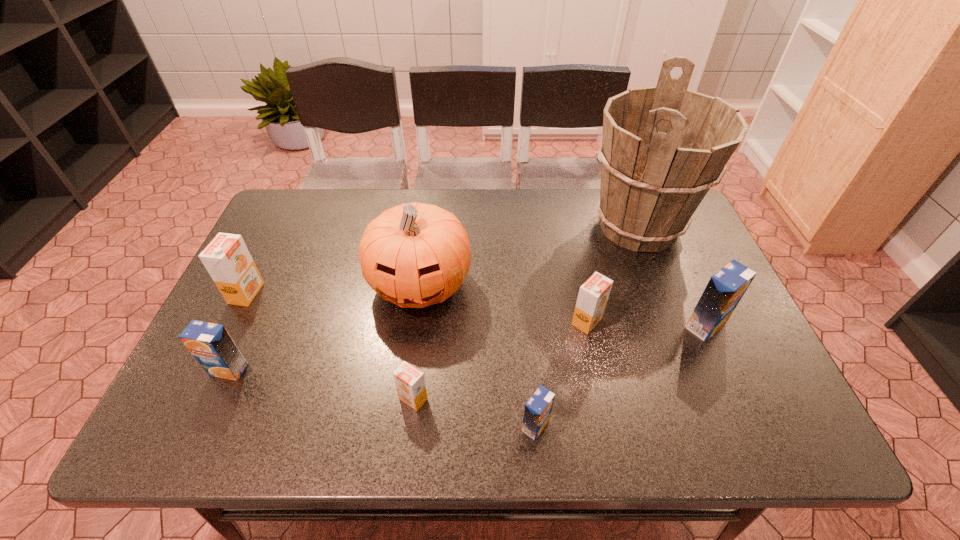
This screenshot has width=960, height=540. I want to click on the second smallest blue orange_juice, so click(x=211, y=345).

I want to click on the nearest orange orange juice, so click(410, 383).

I want to click on the smallest orange orange juice, so click(410, 383).

The image size is (960, 540). I want to click on the fourth object from right to left, so click(x=537, y=412).

Where is `the third orange_juice from right to left`? the third orange_juice from right to left is located at coordinates (537, 412).

The image size is (960, 540). Find the location of `vacant position located on the front of the bucket`. vacant position located on the front of the bucket is located at coordinates (664, 295).

At what (x,y) coordinates should I click in order to perform the action: click on vacant position located 0.150m on the front-facing side of the second tallest object. Please return your answer as a coordinate pair (x, y). The image size is (960, 540). Looking at the image, I should click on (408, 378).

This screenshot has height=540, width=960. I want to click on vacant space located on the back of the rightmost orange_juice, so click(x=676, y=259).

Locate an element on the screen. vacant space situated on the back of the biggest orange orange juice is located at coordinates (x=292, y=201).

Where is `free space located on the back of the fifth orange_juice from left to right`? The image size is (960, 540). free space located on the back of the fifth orange_juice from left to right is located at coordinates (569, 239).